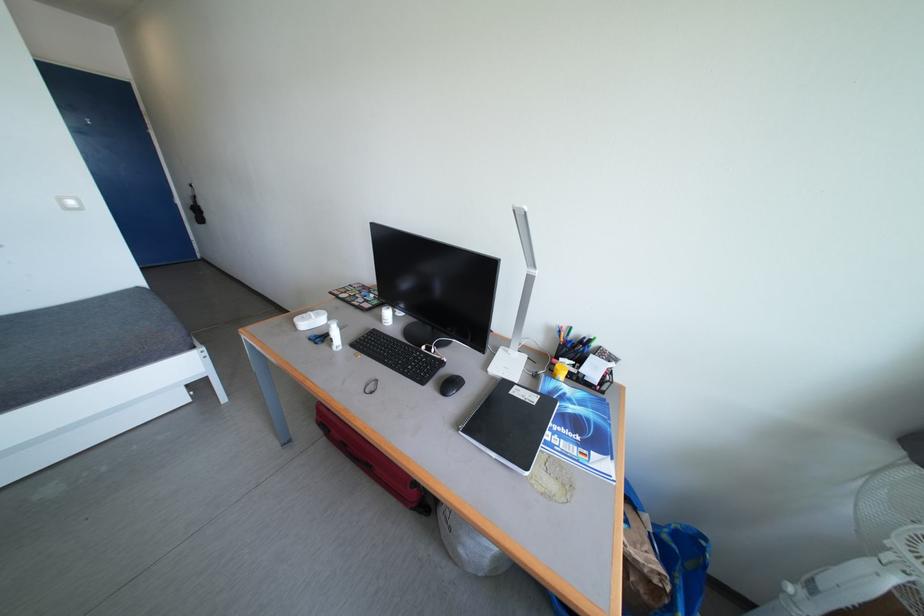
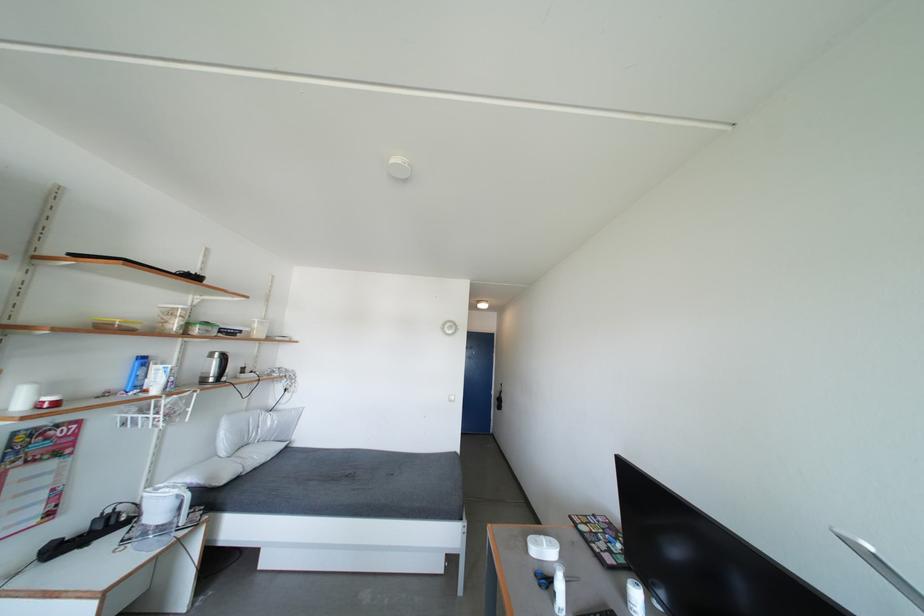
The point at (317,318) is marked in the first image. Where is the corresponding point in the second image?

(550, 544)